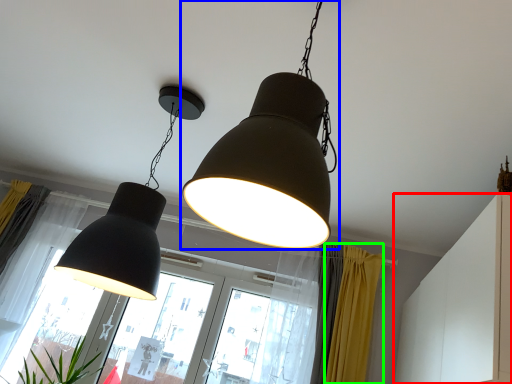
Question: Which object is the closest to the dresser (highlighted by a red box)? Choose among these: lamp (highlighted by a blue box) or curtain (highlighted by a green box).

Choices:
 (A) lamp
 (B) curtain

Answer: (B)